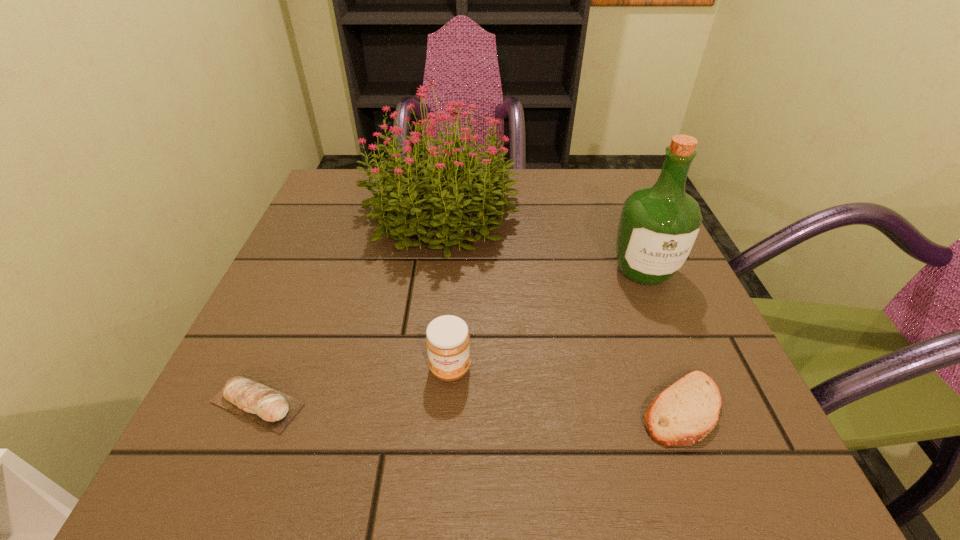
Locate an element on the screen. free space between the bouquet and the shortest object is located at coordinates (562, 310).

Find the location of a particular element. vacant area that lies between the taller pita bread and the bouquet is located at coordinates coord(349,307).

Where is `vacant point located between the fourth tallest object and the right pita bread`? This screenshot has height=540, width=960. vacant point located between the fourth tallest object and the right pita bread is located at coordinates (469, 406).

Identify the location of free space between the right pita bread and the jam. The height and width of the screenshot is (540, 960). (565, 389).

Where is `blank region between the right pita bread and the bouquet`? The width and height of the screenshot is (960, 540). blank region between the right pita bread and the bouquet is located at coordinates (562, 310).

Identify which object is the nearest to the third tallest object. Please provide its 2D coordinates. Your answer should be formatted as a tuple, i.e. [(x, y)], where the tuple contains the x and y coordinates of a point satisfying the conditions above.

[(270, 408)]

Where is `the fourth closest object to the right pita bread`? This screenshot has width=960, height=540. the fourth closest object to the right pita bread is located at coordinates (270, 408).

What are the coordinates of `vacant area in the image that satisfies the following two spatial constraints: 1. on the front side of the left pita bread; 2. on the right side of the shortest object` in the screenshot? It's located at (255, 409).

Locate an element on the screen. Image resolution: width=960 pixels, height=540 pixels. free region that satisfies the following two spatial constraints: 1. on the front label of the jam; 2. on the left side of the shortest object is located at coordinates (447, 409).